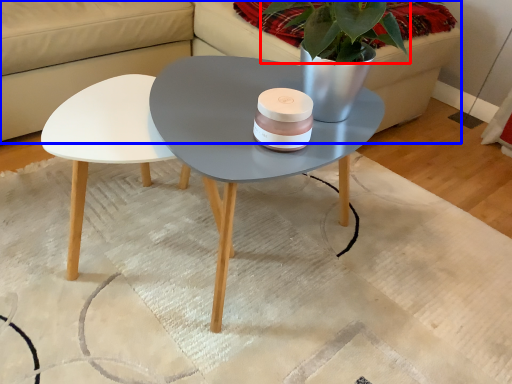
Question: Among these objects, which one is nearest to the camera, plant (highlighted by a red box) or couch (highlighted by a blue box)?

Choices:
 (A) plant
 (B) couch

Answer: (B)